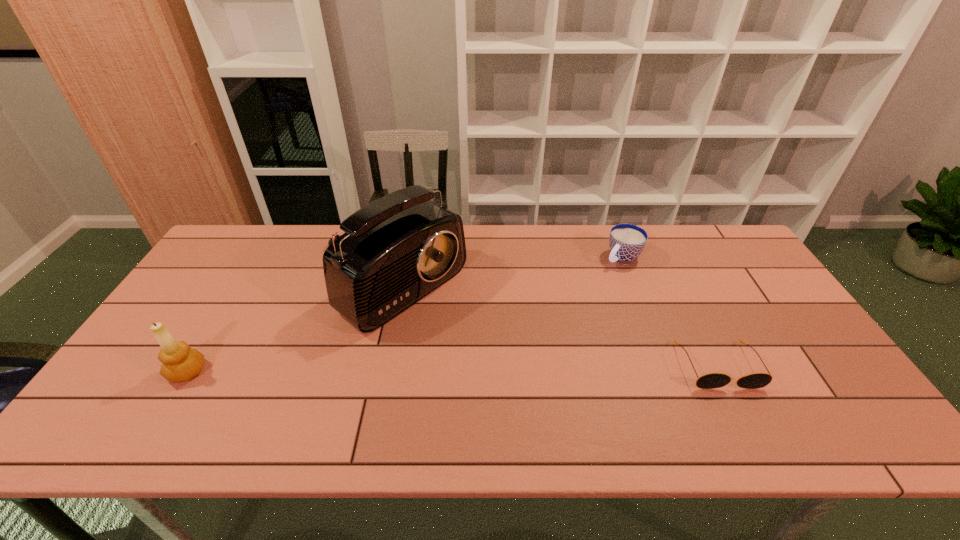
Where is `blank region between the sunglasses and the cup`? The image size is (960, 540). blank region between the sunglasses and the cup is located at coordinates (x=670, y=312).

Locate an element on the screen. This screenshot has width=960, height=540. free point between the sunglasses and the third tallest object is located at coordinates (670, 312).

Image resolution: width=960 pixels, height=540 pixels. Find the location of `free space between the leftmost object and the sunglasses`. free space between the leftmost object and the sunglasses is located at coordinates (452, 369).

This screenshot has width=960, height=540. I want to click on empty location between the radio receiver and the third tallest object, so click(x=506, y=270).

What are the coordinates of `object that stands as the closest to the leftmost object` in the screenshot? It's located at (397, 249).

Where is `object that is the second closest to the second object from left to right`? The width and height of the screenshot is (960, 540). object that is the second closest to the second object from left to right is located at coordinates (627, 241).

This screenshot has width=960, height=540. Identify the location of vacant space that satisfies the following two spatial constraints: 1. on the back side of the cup; 2. on the right side of the second tallest object. (257, 258).